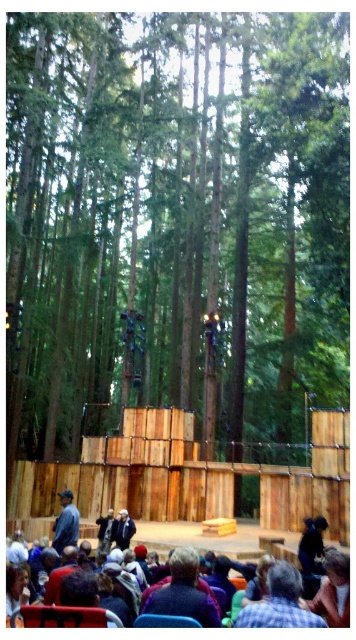
You are an audience member sitting at the back of the forest stage. You notice a brown wood tree at center and a light brown leather jacket at lower center. Which object appears bigger in your view?

The brown wood tree at center appears bigger in your view because it has a larger size compared to the light brown leather jacket at lower center.

You are an audience member sitting in the front row of the outdoor theater. You notice the brown wood tree at center and the dark blue shirt at lower left. Which object appears bigger in your view?

The brown wood tree at center appears bigger in your view because it has a larger size compared to the dark blue shirt at lower left.

You are a stagehand carrying a 30 meter long extension cord and need to reach the brown wood tree at center from the light brown leather jacket at lower center. Can you determine if the extension cord will reach the tree?

The brown wood tree at center is 26.87 meters away from the light brown leather jacket at lower center. Since the extension cord is 30 meters long, it will be sufficient to reach the tree.